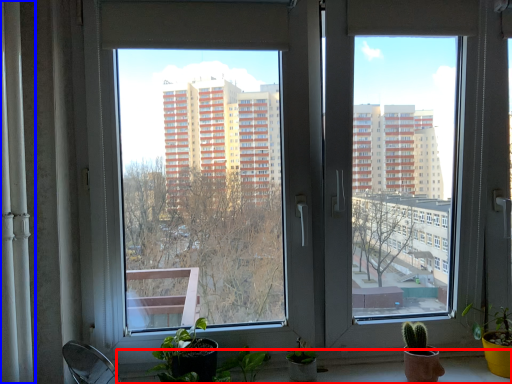
Question: Which object is closer to the camera taking this photo, window sill (highlighted by a red box) or curtain (highlighted by a blue box)?

Choices:
 (A) window sill
 (B) curtain

Answer: (B)